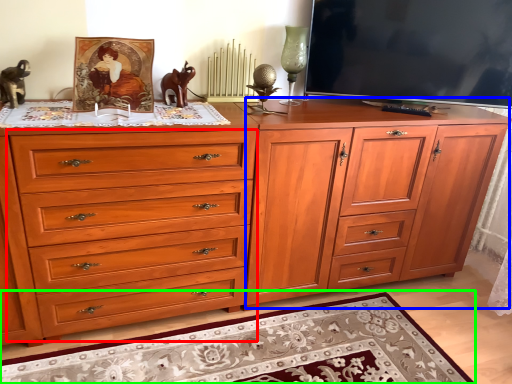
Question: Which object is positioned farthest from drawer (highlighted by a red box)? Select from file cabinet (highlighted by a blue box) and mat (highlighted by a green box).

Choices:
 (A) file cabinet
 (B) mat

Answer: (A)